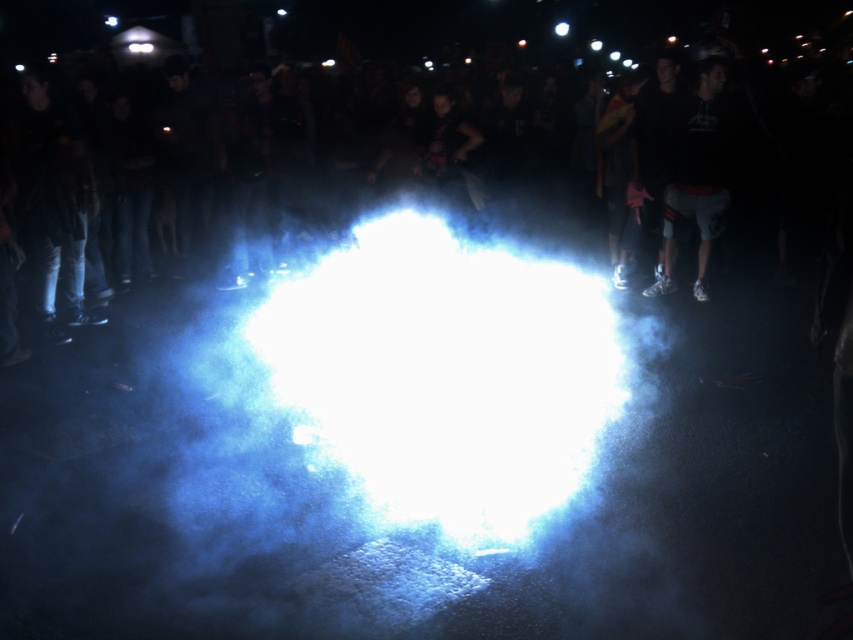
You are standing in the crowd observing the spotlight in the center. You notice two points marked in the scene. Which point is closer to you, point (563, 493) or point (669, 244)?

Point (563, 493) is in front of point (669, 244), so it is closer to you.